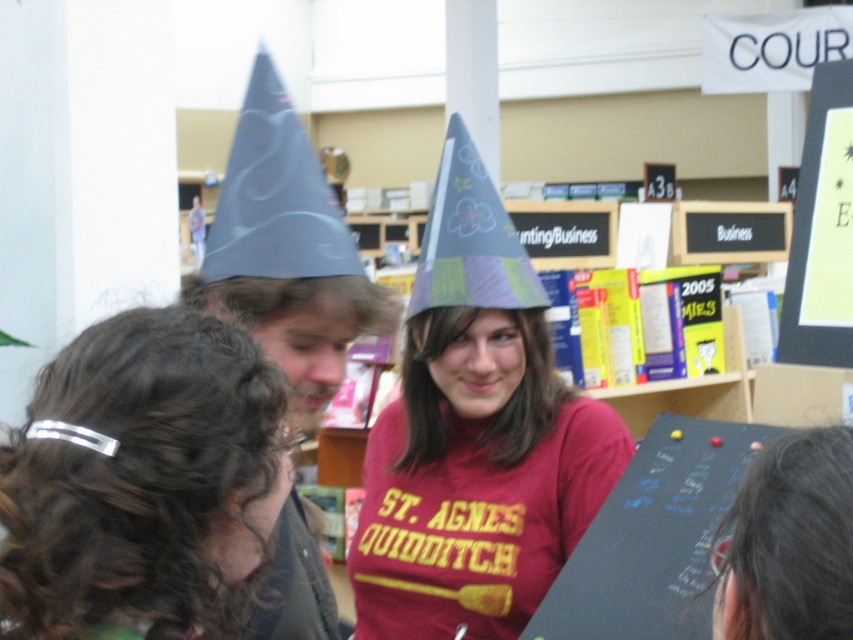
Between black chalkboard at center and dark brown hair at lower right, which one appears on the right side from the viewer's perspective?

black chalkboard at center

Is black chalkboard at center wider than dark brown hair at lower right?

Correct, the width of black chalkboard at center exceeds that of dark brown hair at lower right.

Does point (697, 529) come closer to viewer compared to point (792, 481)?

No, it is not.

Where is `black chalkboard at center`? This screenshot has width=853, height=640. black chalkboard at center is located at coordinates (653, 538).

Between matte purple party hat at center and dark brown hair at lower right, which one is positioned higher?

Positioned higher is matte purple party hat at center.

Is point (460, 568) positioned in front of point (720, 572)?

That is False.

Where is `matte purple party hat at center`? The image size is (853, 640). matte purple party hat at center is located at coordinates (474, 435).

Between point (511, 428) and point (239, 212), which one is positioned behind?

Positioned behind is point (511, 428).

Based on the photo, which is more to the left, matte purple party hat at center or matte blue paper party hat at upper center?

matte blue paper party hat at upper center is more to the left.

I want to click on matte purple party hat at center, so click(x=474, y=435).